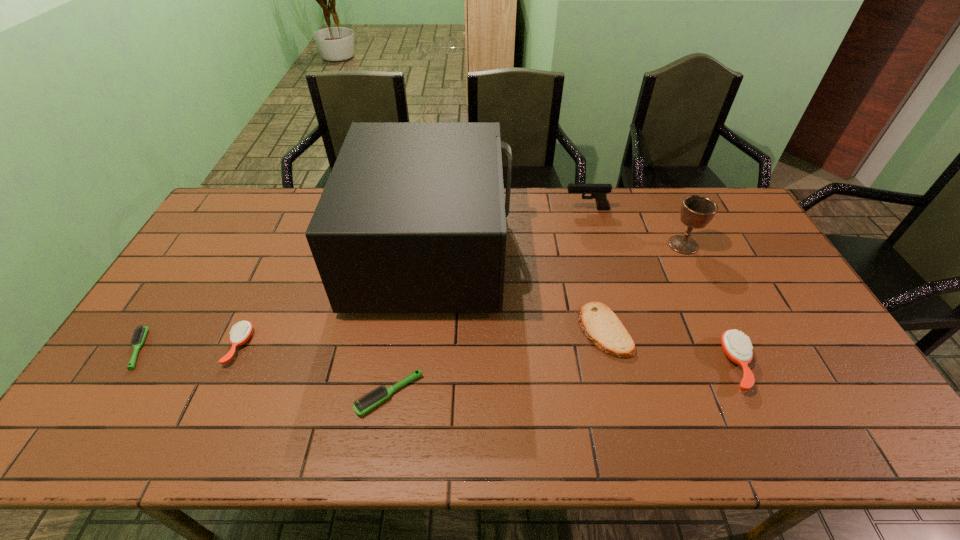
Locate an element on the screen. This screenshot has height=540, width=960. the tallest object is located at coordinates (412, 219).

Identify the location of chalice. This screenshot has height=540, width=960. (697, 211).

The image size is (960, 540). Identify the location of pistol. (599, 192).

What are the coordinates of `the bigger orange hairbrush` in the screenshot? It's located at (735, 344).

This screenshot has height=540, width=960. I want to click on the fourth tallest object, so click(735, 344).

This screenshot has height=540, width=960. Identify the location of the second hairbrush from left to right. (240, 334).

Locate an element on the screen. The width and height of the screenshot is (960, 540). the left orange hairbrush is located at coordinates (240, 334).

Locate an element on the screen. pita bread is located at coordinates (599, 323).

Where is `the second hairbrush from right to left`? The width and height of the screenshot is (960, 540). the second hairbrush from right to left is located at coordinates (373, 398).

Where is `the third tallest hairbrush`? the third tallest hairbrush is located at coordinates (373, 398).